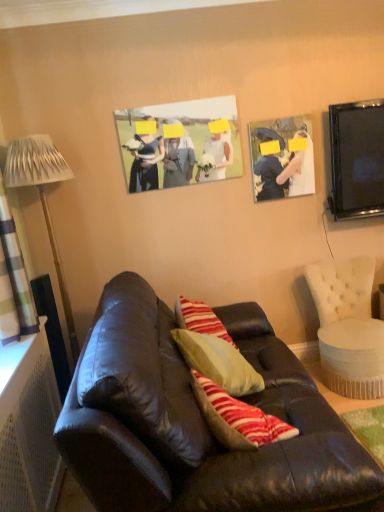
Question: In terms of height, does metallic silver lamp at left look taller or shorter compared to matte paper photo at center, arranged as the 1th picture frame when viewed from the left?

Choices:
 (A) short
 (B) tall

Answer: (B)

Question: From a real-world perspective, is metallic silver lamp at left physically located above or below matte paper photo at center, the second picture frame from the right?

Choices:
 (A) below
 (B) above

Answer: (A)

Question: Estimate the real-world distances between objects in this image. Which object is closer to the matte black photo frame at upper right, which appears as the second picture frame when viewed from the left?

Choices:
 (A) matte paper photo at center, the second picture frame from the right
 (B) metallic silver lamp at left
 (C) white tufted fabric chair at right
 (D) white perforated radiator at lower left
 (E) matte black couch at center

Answer: (A)

Question: Estimate the real-world distances between objects in this image. Which object is closer to the matte black photo frame at upper right, arranged as the 1th picture frame when viewed from the right?

Choices:
 (A) black glossy tv at upper right
 (B) white perforated radiator at lower left
 (C) matte paper photo at center, the second picture frame from the right
 (D) plaid fabric curtain at left
 (E) metallic silver lamp at left

Answer: (A)